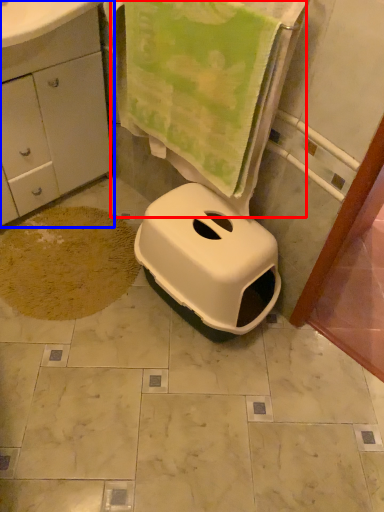
Question: Which point is further to the camera, beach towel (highlighted by a red box) or bathroom cabinet (highlighted by a blue box)?

Choices:
 (A) beach towel
 (B) bathroom cabinet

Answer: (B)